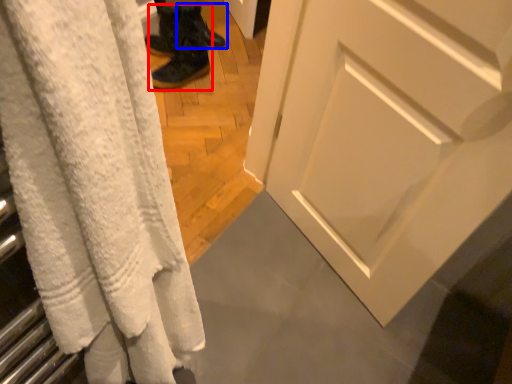
Question: Which point is further to the camera, footwear (highlighted by a red box) or footwear (highlighted by a blue box)?

Choices:
 (A) footwear
 (B) footwear

Answer: (B)